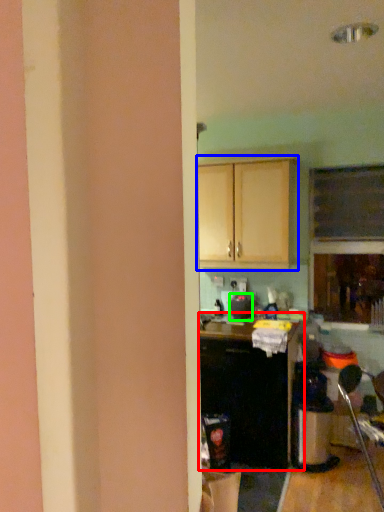
Question: Estimate the real-world distances between objects in this image. Which object is farther from cabinetry (highlighted by a red box), cabinetry (highlighted by a blue box) or appliance (highlighted by a green box)?

Choices:
 (A) cabinetry
 (B) appliance

Answer: (A)